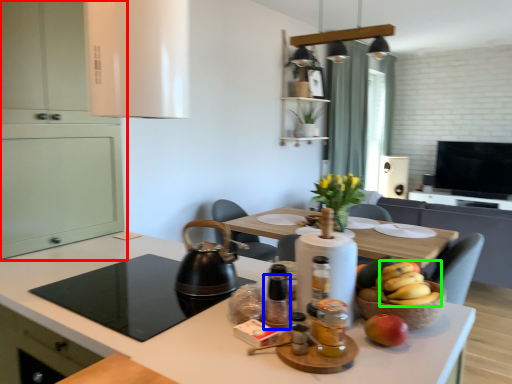
Question: Which object is the closest to the cabinetry (highlighted by a red box)? Choose among these: bottle (highlighted by a blue box) or banana (highlighted by a green box).

Choices:
 (A) bottle
 (B) banana

Answer: (A)